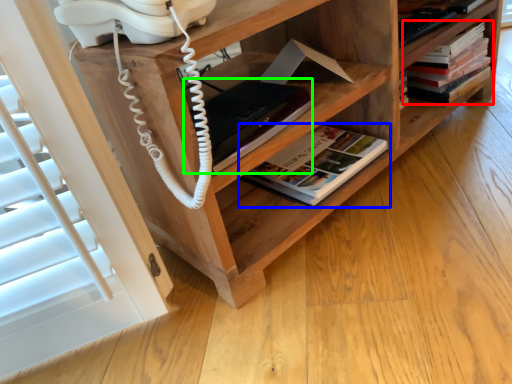
Question: Considering the real-world distances, which object is closest to book (highlighted by a red box)? book (highlighted by a blue box) or paperback book (highlighted by a green box).

Choices:
 (A) book
 (B) paperback book

Answer: (A)